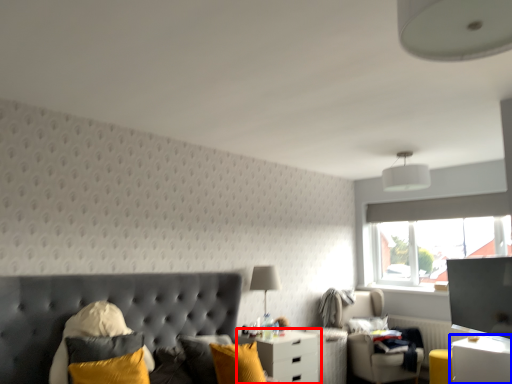
Question: Which object appears farthest to the camera in this image, nightstand (highlighted by a red box) or nightstand (highlighted by a blue box)?

Choices:
 (A) nightstand
 (B) nightstand

Answer: (A)